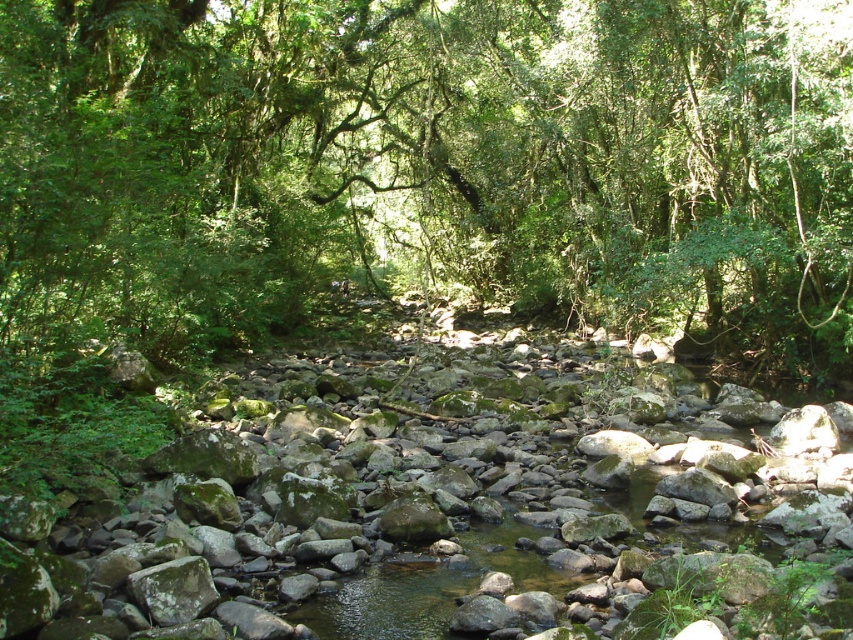
Based on the photo, you are a hiker trying to navigate through the forest and need to cross the stream. You see the green leafy tree at center and the green mossy rock at center. Which object should you use as a reference point to locate the mossy rock if you can only see the tree first?

The green leafy tree at center is positioned on the left side of the green mossy rock at center, so if you see the tree first, the mossy rock is to the right of it.

You are a hiker standing in the forest and want to reach a clearing beyond the green mossy rock at center. The green leafy tree at center is blocking your path. Can you walk around the tree to get to the rock?

The green leafy tree at center is further to the viewer than the green mossy rock at center, so the tree is closer to you. You can walk around the tree to reach the rock behind it.